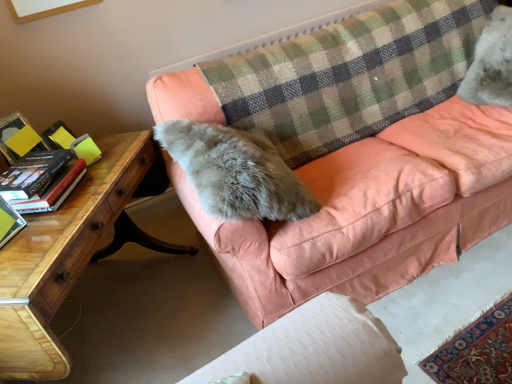
Question: Is green matte book at left, positioned as the 1th paperback book in front-to-back order, facing away from wooden desk at lower left?

Choices:
 (A) yes
 (B) no

Answer: (B)

Question: From the image's perspective, is green matte book at left, positioned as the 1th paperback book in front-to-back order, above wooden desk at lower left?

Choices:
 (A) yes
 (B) no

Answer: (A)

Question: Does green matte book at left, positioned as the 1th paperback book in front-to-back order, have a larger size compared to wooden desk at lower left?

Choices:
 (A) yes
 (B) no

Answer: (B)

Question: Does green matte book at left, positioned as the 1th paperback book in front-to-back order, turn towards wooden desk at lower left?

Choices:
 (A) no
 (B) yes

Answer: (A)

Question: Can you confirm if green matte book at left, positioned as the 1th paperback book in front-to-back order, is positioned to the right of wooden desk at lower left?

Choices:
 (A) no
 (B) yes

Answer: (A)

Question: From a real-world perspective, is wooden desk at lower left positioned above or below checkered fabric plaid at upper center?

Choices:
 (A) below
 (B) above

Answer: (A)

Question: Is wooden desk at lower left situated inside checkered fabric plaid at upper center or outside?

Choices:
 (A) outside
 (B) inside

Answer: (A)

Question: Is wooden desk at lower left taller or shorter than checkered fabric plaid at upper center?

Choices:
 (A) tall
 (B) short

Answer: (A)

Question: Based on their positions, is wooden desk at lower left located to the left or right of checkered fabric plaid at upper center?

Choices:
 (A) left
 (B) right

Answer: (A)

Question: In terms of size, does white fluffy cat at upper right appear bigger or smaller than wooden desk at lower left?

Choices:
 (A) big
 (B) small

Answer: (B)

Question: From a real-world perspective, is white fluffy cat at upper right above or below wooden desk at lower left?

Choices:
 (A) above
 (B) below

Answer: (A)

Question: Is white fluffy cat at upper right inside or outside of wooden desk at lower left?

Choices:
 (A) inside
 (B) outside

Answer: (B)

Question: Considering their positions, is white fluffy cat at upper right located in front of or behind wooden desk at lower left?

Choices:
 (A) behind
 (B) front

Answer: (A)

Question: Is wooden desk at lower left bigger or smaller than peach velvet couch at center?

Choices:
 (A) big
 (B) small

Answer: (B)

Question: From a real-world perspective, relative to peach velvet couch at center, is wooden desk at lower left vertically above or below?

Choices:
 (A) below
 (B) above

Answer: (A)